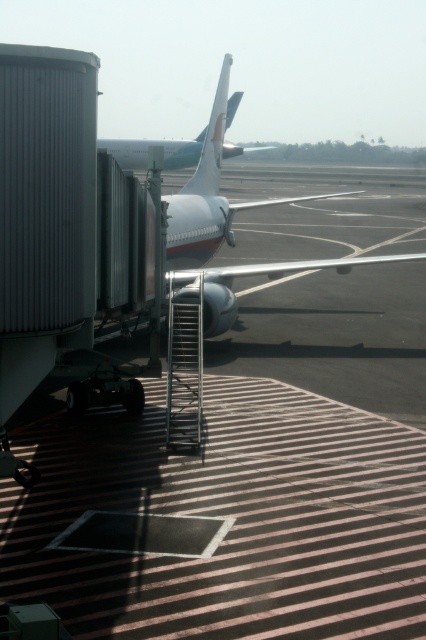
Question: Is smooth asphalt tarmac at center to the right of white glossy tail at upper center from the viewer's perspective?

Choices:
 (A) no
 (B) yes

Answer: (B)

Question: Which object is positioned closest to the white glossy airplane at center?

Choices:
 (A) smooth asphalt tarmac at center
 (B) white glossy tail at upper center

Answer: (A)

Question: Is smooth asphalt tarmac at center below white glossy tail at upper center?

Choices:
 (A) yes
 (B) no

Answer: (A)

Question: Considering the relative positions of smooth asphalt tarmac at center and white glossy airplane at center in the image provided, where is smooth asphalt tarmac at center located with respect to white glossy airplane at center?

Choices:
 (A) right
 (B) left

Answer: (A)

Question: Which point is closer to the camera?

Choices:
 (A) (204, 180)
 (B) (224, 604)

Answer: (B)

Question: Which point appears closest to the camera in this image?

Choices:
 (A) (417, 508)
 (B) (287, 262)
 (C) (215, 189)

Answer: (A)